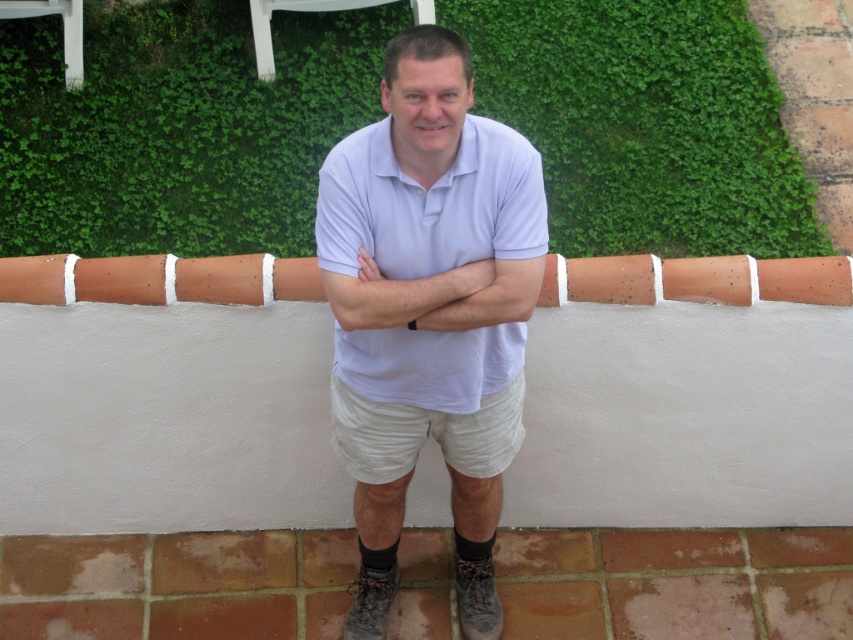
Question: Which point is closer to the camera?

Choices:
 (A) (473, 339)
 (B) (453, 445)
 (C) (50, 52)

Answer: (A)

Question: Among these objects, which one is nearest to the camera?

Choices:
 (A) green leafy hedge at upper center
 (B) light blue cotton polo shirt at center

Answer: (B)

Question: Does light blue cotton polo shirt at center have a smaller size compared to beige cotton shorts at center?

Choices:
 (A) no
 (B) yes

Answer: (A)

Question: Which point is closer to the camera?

Choices:
 (A) (310, 145)
 (B) (410, 241)
 (C) (500, 444)
 (D) (438, 410)

Answer: (B)

Question: From the image, what is the correct spatial relationship of green leafy hedge at upper center in relation to beige cotton shorts at center?

Choices:
 (A) below
 (B) above

Answer: (B)

Question: Is the position of light blue cotton shirt at center more distant than that of light blue cotton polo shirt at center?

Choices:
 (A) no
 (B) yes

Answer: (A)